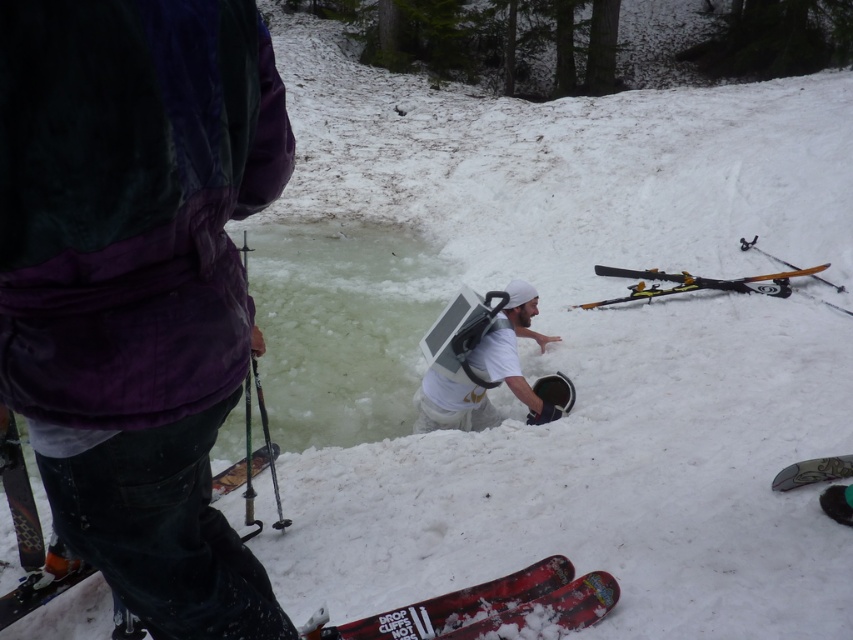
You are a rescue worker trying to locate the purple fleece jacket at upper left and the red matte snowboard at lower center in the snowy mountain scene. Based on their positions, which object is higher up the slope?

The purple fleece jacket at upper left is located above the red matte snowboard at lower center, so the purple fleece jacket at upper left is higher up the slope.